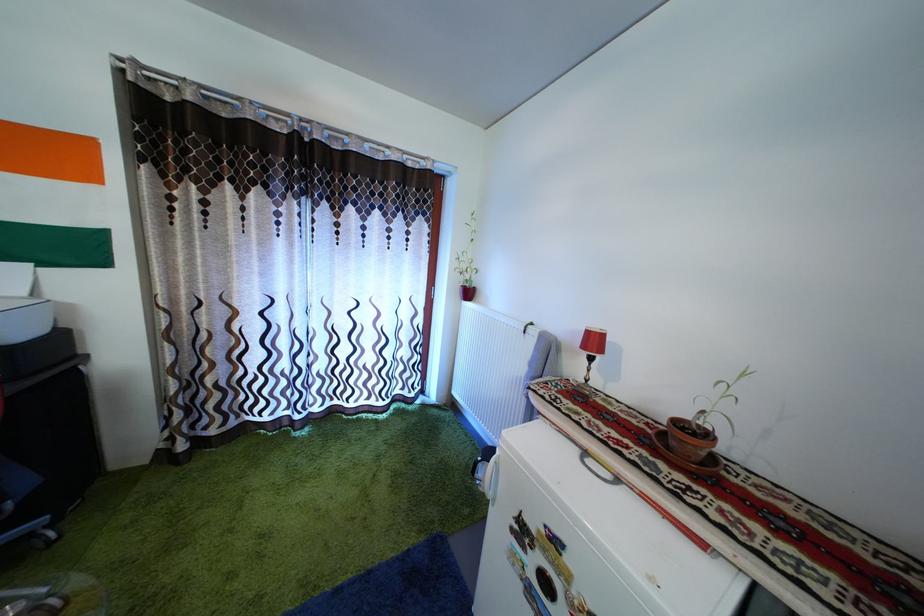
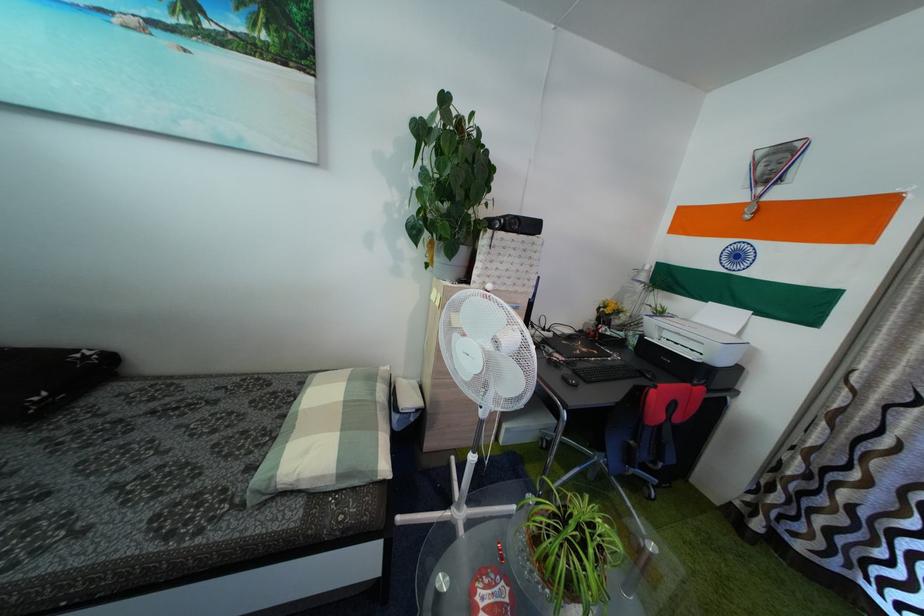
Question: The camera is either moving clockwise (left) or counter-clockwise (right) around the object. The first image is from the beginning of the video and the second image is from the end. Is the camera moving left or right when shooting the video?

Choices:
 (A) Left
 (B) Right

Answer: (B)